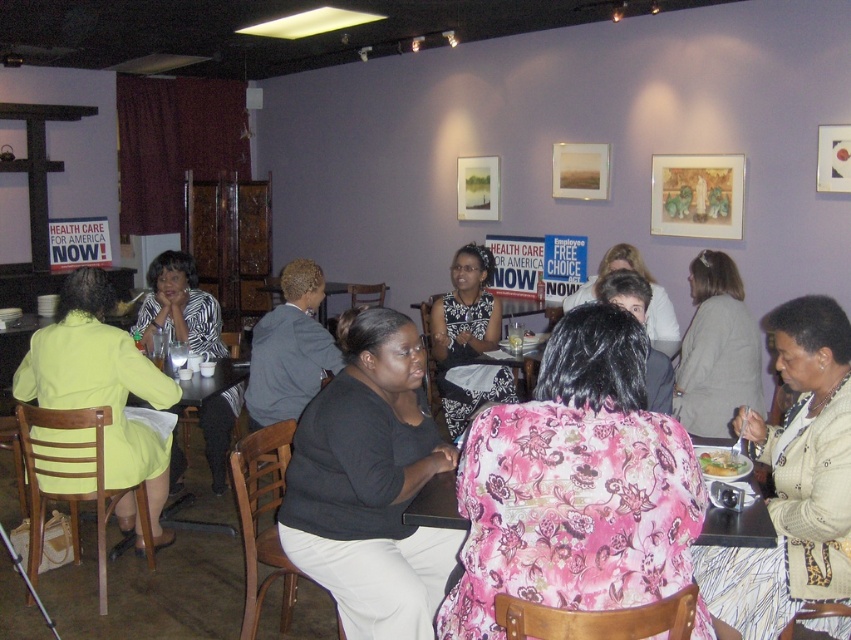
You are a photographer setting up a camera to capture a group photo of the light beige sweater at lower right and the black and white dress at center. The camera has a limited focus width. Which person should you position closer to the center to ensure both are in focus?

The light beige sweater at lower right might be wider than the black and white dress at center, so positioning the wider light beige sweater at lower right closer to the center would help ensure both are within the camera focus width.

You are a photographer trying to capture a candid shot of the black and white dress at center without the light beige sweater at lower right blocking the view. Can you adjust your position to do so?

The light beige sweater at lower right is in front of the black and white dress at center, so moving to a position where you can see behind or around the light beige sweater at lower right would allow you to capture the black and white dress at center without obstruction.